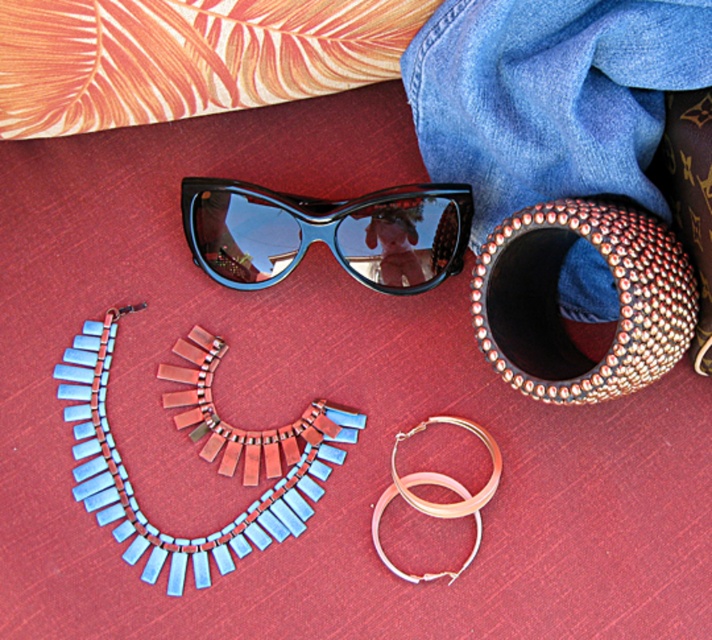
You are a photographer trying to capture both the black glossy sunglasses at upper center and the gold metallic hoop earrings at upper center in a single shot. The camera you are using has a minimum focus distance of 12 inches. Will you be able to capture both items clearly without moving the camera?

The black glossy sunglasses at upper center and gold metallic hoop earrings at upper center are 13.04 inches apart from each other. Since the camera requires a minimum focus distance of 12 inches, the 13.04 inches distance allows both items to be within the focus range, so yes, you can capture both clearly without moving the camera.

You are a photographer trying to capture a closeup shot of the studded leather bracelet at upper right and the black glossy sunglasses at upper center. Since your camera can only focus on objects within 8 inches of each other, will you be able to capture both items in sharp focus?

The distance between the studded leather bracelet at upper right and the black glossy sunglasses at upper center is 7.75 inches, which is within the 8 inch focus range. Therefore, you can capture both items in sharp focus.